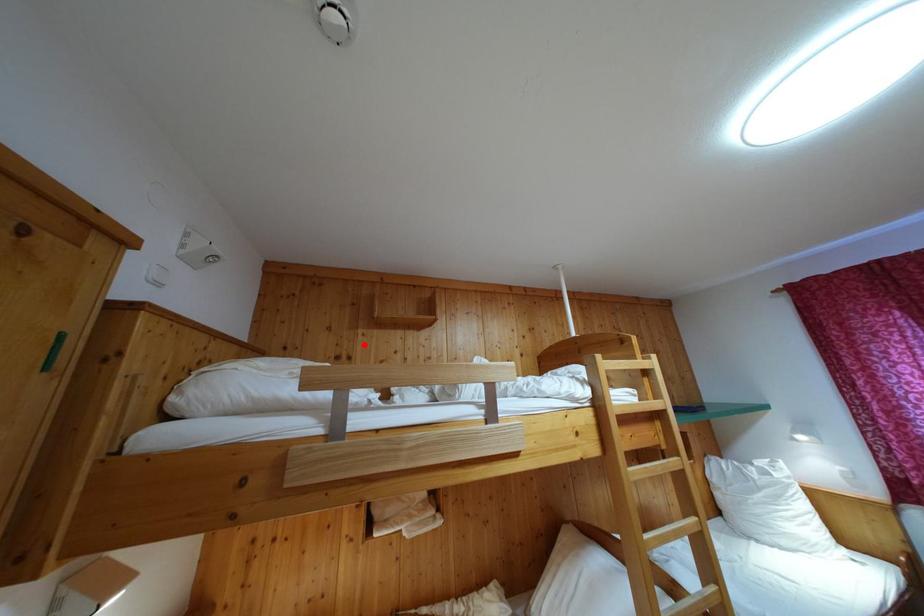
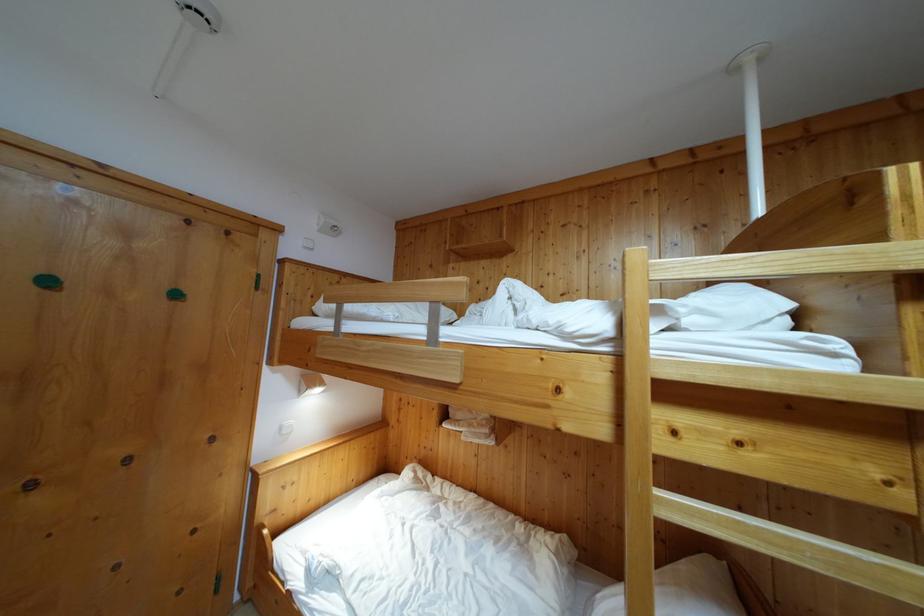
Locate, in the second image, the point that corresponds to the highlighted location in the first image.

(455, 278)